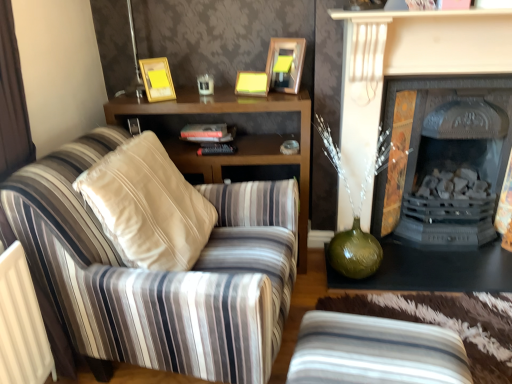
Image resolution: width=512 pixels, height=384 pixels. Find the location of `vacant area situated below matte black fireplace at center, acting as the first fireplace starting from the front (from a real-world perspective)`. vacant area situated below matte black fireplace at center, acting as the first fireplace starting from the front (from a real-world perspective) is located at coordinates (446, 258).